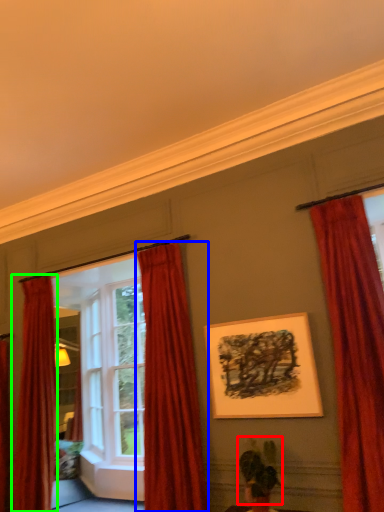
Question: Considering the real-world distances, which object is farthest from plant (highlighted by a red box)? curtain (highlighted by a blue box) or curtain (highlighted by a green box)?

Choices:
 (A) curtain
 (B) curtain

Answer: (B)